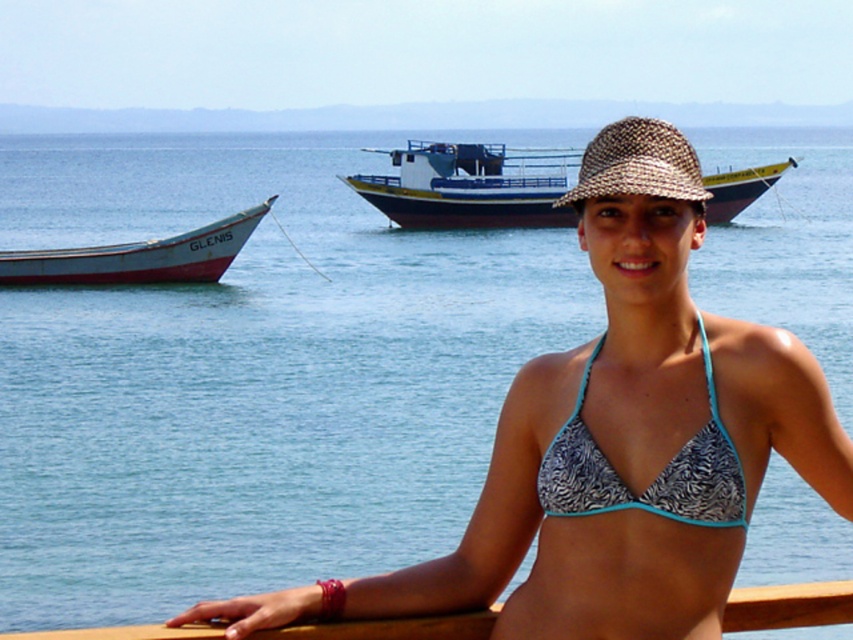
You are a photographer positioned at the camera. You want to take a photo of both the point at coordinates point [567,186] and point [158,266]. Which point is closer to your camera?

Point [158,266] is closer to the camera because the description states that point [567,186] is further away from it.

You are a photographer planning to take a picture of the blue painted wooden boat at center and the white wooden boat at left. Which boat should you focus on first if you want to capture both in the frame without moving the camera?

You should focus on the white wooden boat at left first because it is lower in the frame, allowing you to adjust the camera angle upward to include the blue painted wooden boat at center which is positioned above it.